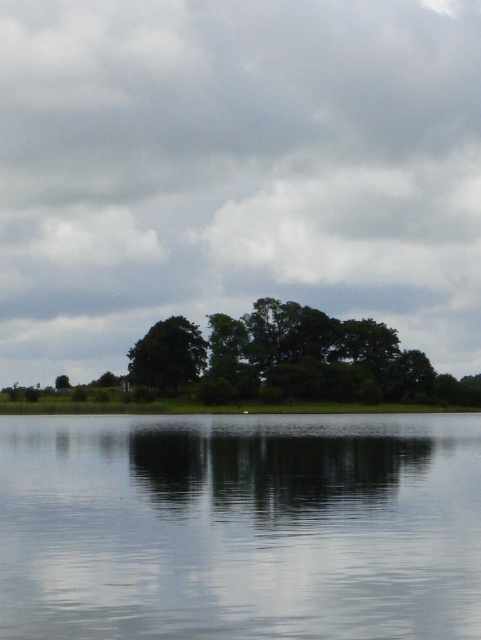
Question: Does transparent water at center lie in front of green leafy tree at center?

Choices:
 (A) no
 (B) yes

Answer: (B)

Question: Which of the following is the closest to the observer?

Choices:
 (A) (169, 369)
 (B) (195, 580)

Answer: (B)

Question: Is transparent water at center above green leafy tree at center?

Choices:
 (A) no
 (B) yes

Answer: (A)

Question: Considering the relative positions of transparent water at center and green leafy tree at center in the image provided, where is transparent water at center located with respect to green leafy tree at center?

Choices:
 (A) right
 (B) left

Answer: (A)

Question: Which of the following is the farthest from the observer?

Choices:
 (A) (150, 385)
 (B) (422, 481)

Answer: (A)